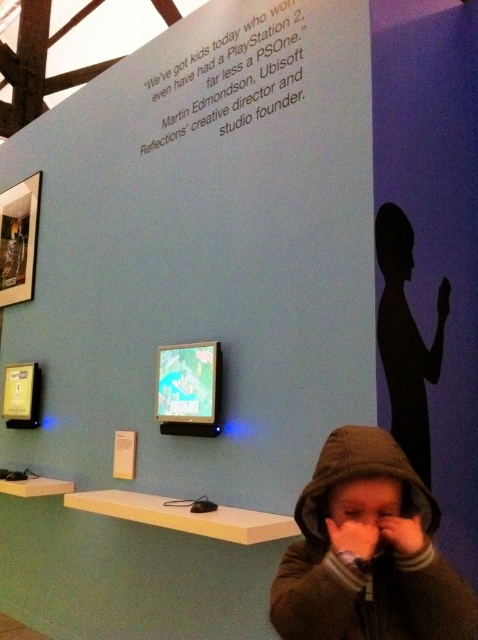
You are standing in the exhibition space and want to touch both the brown fleece hoodie at lower right and the pink matte nose at center. Which object should you reach for first to touch the one closer to you?

You should reach for the brown fleece hoodie at lower right first because it is closer to you than the pink matte nose at center.